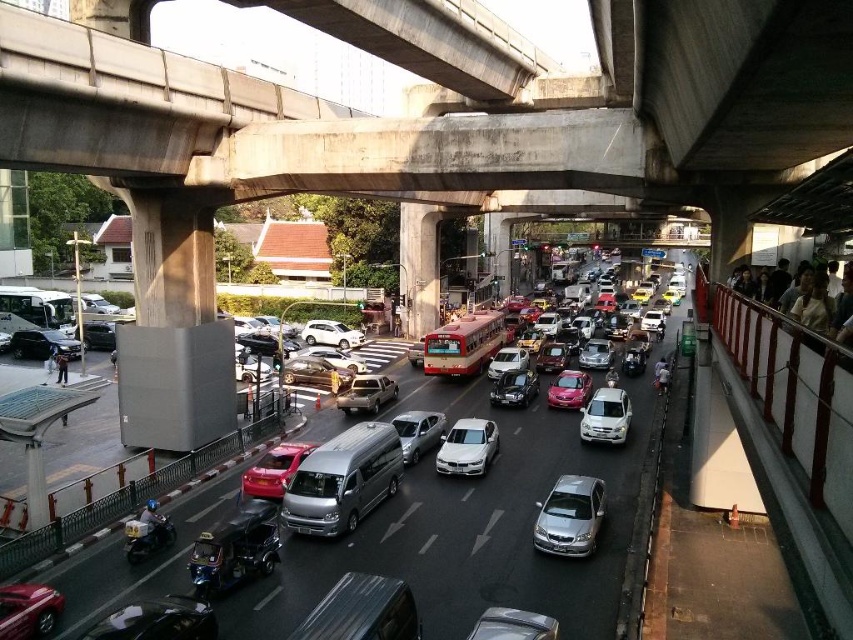
Consider the image. How far apart are white metallic sedan at center and metallic silver pickup truck at center?

white metallic sedan at center is 8.52 meters from metallic silver pickup truck at center.

Between white metallic sedan at center and metallic silver pickup truck at center, which one appears on the left side from the viewer's perspective?

metallic silver pickup truck at center is more to the left.

At what (x,y) coordinates should I click in order to perform the action: click on white metallic sedan at center. Please return your answer as a coordinate pair (x, y). Image resolution: width=853 pixels, height=640 pixels. Looking at the image, I should click on (467, 448).

Image resolution: width=853 pixels, height=640 pixels. I want to click on white metallic sedan at center, so click(x=467, y=448).

Is concrete at center below matte red bus at center?

No.

Between concrete at center and matte red bus at center, which one has more height?

concrete at center is taller.

Between point (73, 140) and point (437, 371), which one is positioned in front?

Positioned in front is point (73, 140).

This screenshot has width=853, height=640. I want to click on concrete at center, so click(444, 102).

Between silver metallic van at center and shiny black car at center, which one has more height?

Standing taller between the two is silver metallic van at center.

Measure the distance between point (368, 481) and camera.

Point (368, 481) and camera are 18.99 meters apart from each other.

The image size is (853, 640). Find the location of `silver metallic van at center`. silver metallic van at center is located at coordinates (343, 481).